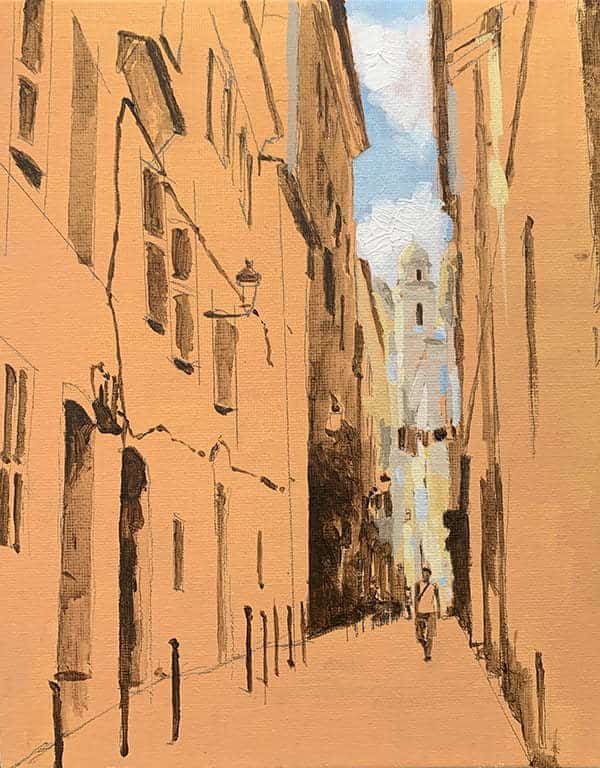
This screenshot has width=600, height=768. I want to click on wall, so click(160, 561).